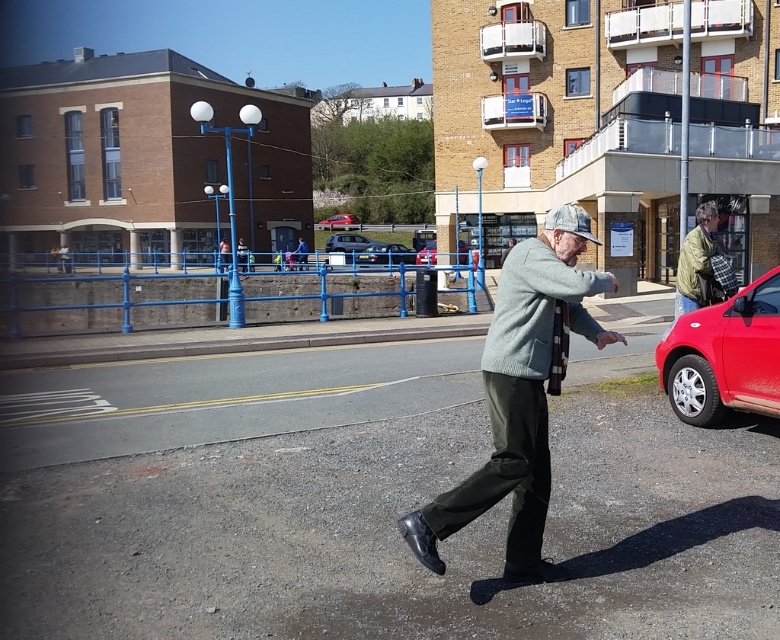
Question: Is shiny red car at right positioned at the back of metallic red car at center?

Choices:
 (A) yes
 (B) no

Answer: (B)

Question: Which point appears closest to the camera in this image?

Choices:
 (A) (317, 221)
 (B) (291, 257)

Answer: (B)

Question: Observing the image, what is the correct spatial positioning of green textured jacket at right in reference to metallic gray hatchback at center?

Choices:
 (A) below
 (B) above

Answer: (A)

Question: Among these points, which one is nearest to the camera?

Choices:
 (A) (298, 260)
 (B) (771, 378)
 (C) (695, 257)
 (D) (353, 241)

Answer: (B)

Question: Is silver metallic hatchback at center thinner than metallic red car at center?

Choices:
 (A) no
 (B) yes

Answer: (A)

Question: Which object is closer to the camera taking this photo?

Choices:
 (A) metallic red car at center
 (B) light blue denim jacket at center
 (C) knitted gray sweater at center

Answer: (C)